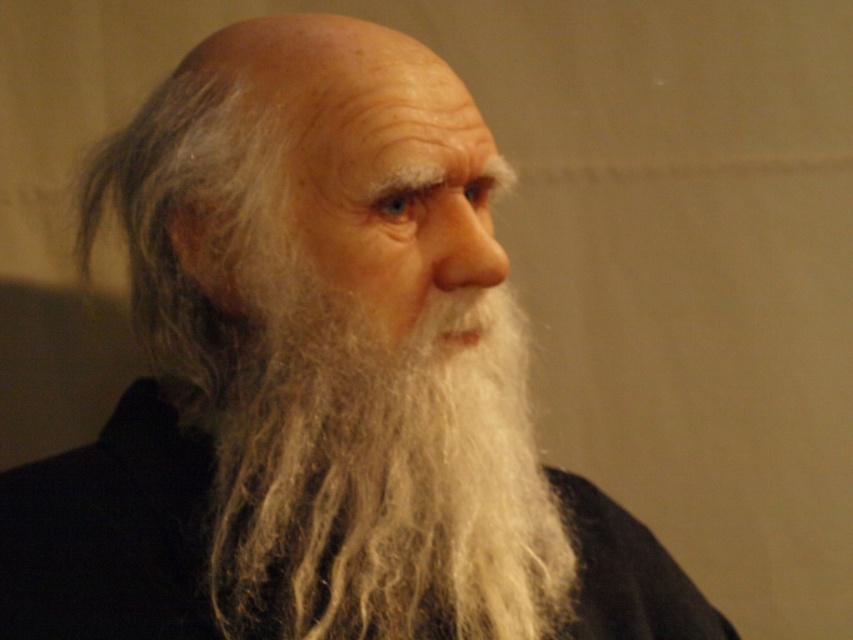
Can you confirm if white woolen beard at center is wider than silky black robe at center?

Yes, white woolen beard at center is wider than silky black robe at center.

You are a GUI agent. You are given a task and a screenshot of the screen. Output one action in this format:
    pyautogui.click(x=<x>, y=<y>)
    Task: Click on the white woolen beard at center
    The width and height of the screenshot is (853, 640).
    Given the screenshot: What is the action you would take?
    coord(380,474)